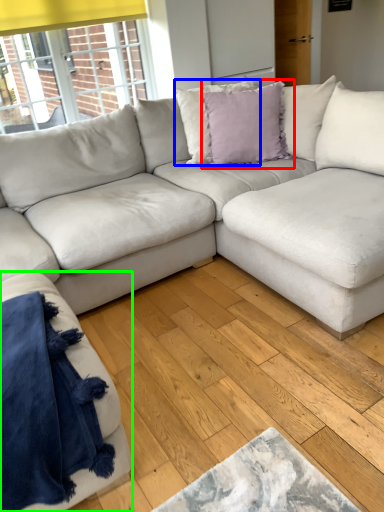
Question: Estimate the real-world distances between objects in this image. Which object is farther from pillow (highlighted by a red box), pillow (highlighted by a blue box) or studio couch (highlighted by a green box)?

Choices:
 (A) pillow
 (B) studio couch

Answer: (B)